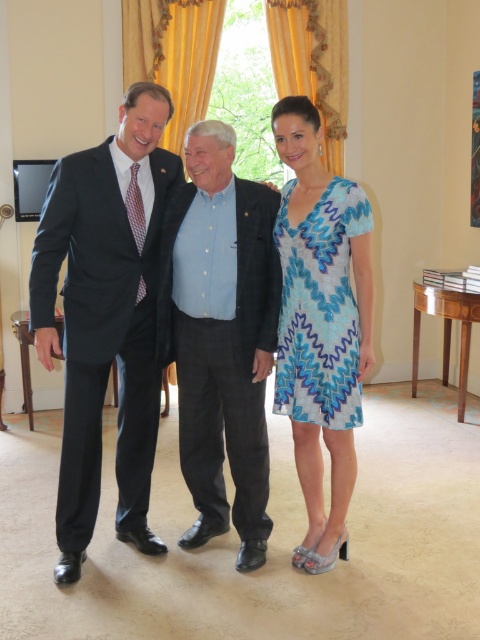
Question: Among these objects, which one is farthest from the camera?

Choices:
 (A) dark blue suit at left
 (B) blue printed fabric dress at right
 (C) matte black suit at left
 (D) blue cotton shirt at center

Answer: (B)

Question: Does dark blue suit at left appear over matte black suit at left?

Choices:
 (A) yes
 (B) no

Answer: (B)

Question: Which object appears closest to the camera in this image?

Choices:
 (A) matte black suit at left
 (B) blue printed fabric dress at right

Answer: (A)

Question: Can you confirm if matte black suit at left is bigger than blue cotton shirt at center?

Choices:
 (A) yes
 (B) no

Answer: (A)

Question: Can you confirm if blue cotton shirt at center is positioned to the left of blue printed fabric dress at right?

Choices:
 (A) no
 (B) yes

Answer: (B)

Question: Among these objects, which one is nearest to the camera?

Choices:
 (A) blue printed dress at center
 (B) blue cotton shirt at center
 (C) matte black suit at left

Answer: (C)